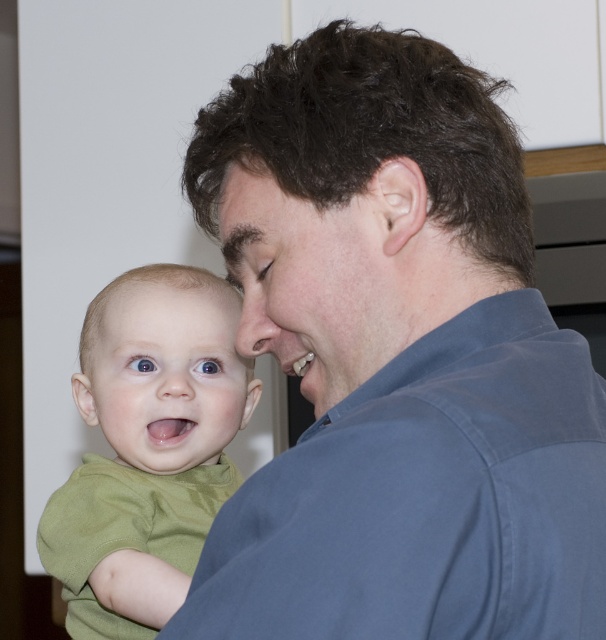
Question: Does smooth skin face at center come behind smooth skin forehead at center?

Choices:
 (A) no
 (B) yes

Answer: (A)

Question: Among these points, which one is farthest from the camera?

Choices:
 (A) 268,328
 (B) 319,291
 (C) 231,406
 (D) 233,173

Answer: (C)

Question: Which of the following is the closest to the observer?

Choices:
 (A) blue cotton shirt at upper right
 (B) smooth green baby face at center
 (C) smooth skin nose at center
 (D) smooth skin face at center

Answer: (A)

Question: Which point is farther to the camera?

Choices:
 (A) (164, 348)
 (B) (445, 81)

Answer: (A)

Question: Does blue cotton shirt at upper right come behind smooth skin face at center?

Choices:
 (A) yes
 (B) no

Answer: (B)

Question: In this image, where is smooth green baby face at center located relative to smooth skin nose at center?

Choices:
 (A) left
 (B) right

Answer: (A)